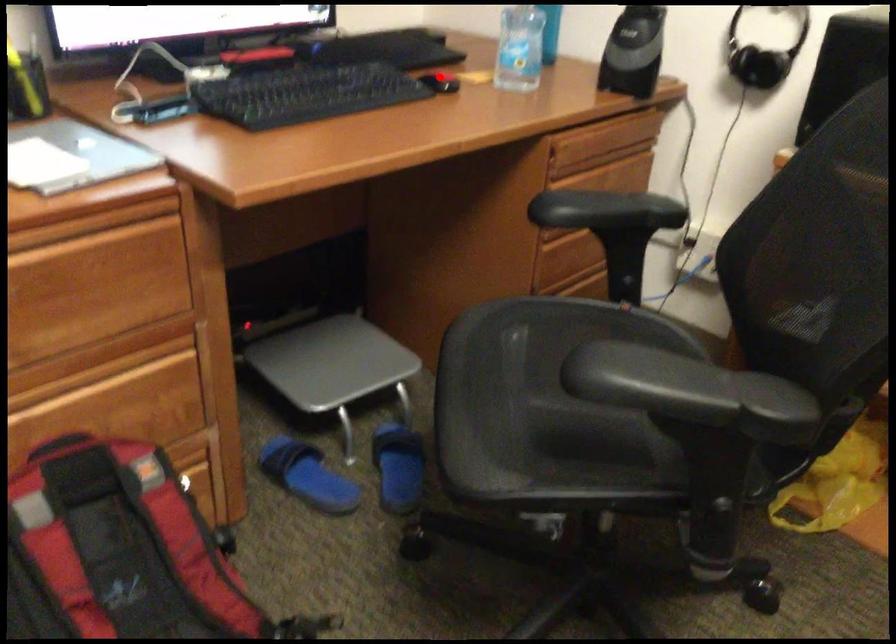
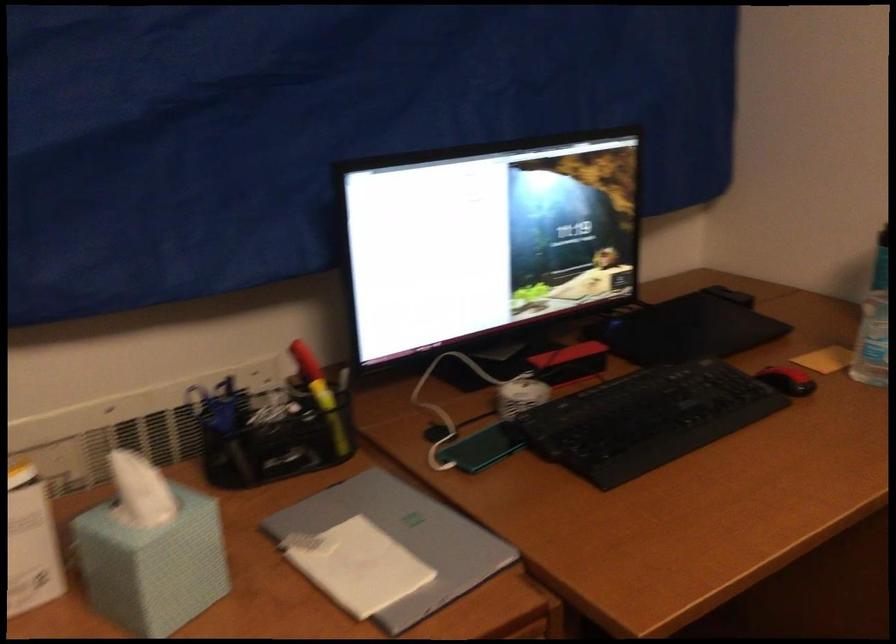
Question: I am providing you with two images of the same scene from different viewpoints. A red point is shown in image1. For the corresponding object point in image2, is it positioned nearer or farther from the camera?

Choices:
 (A) Nearer
 (B) Farther

Answer: (A)